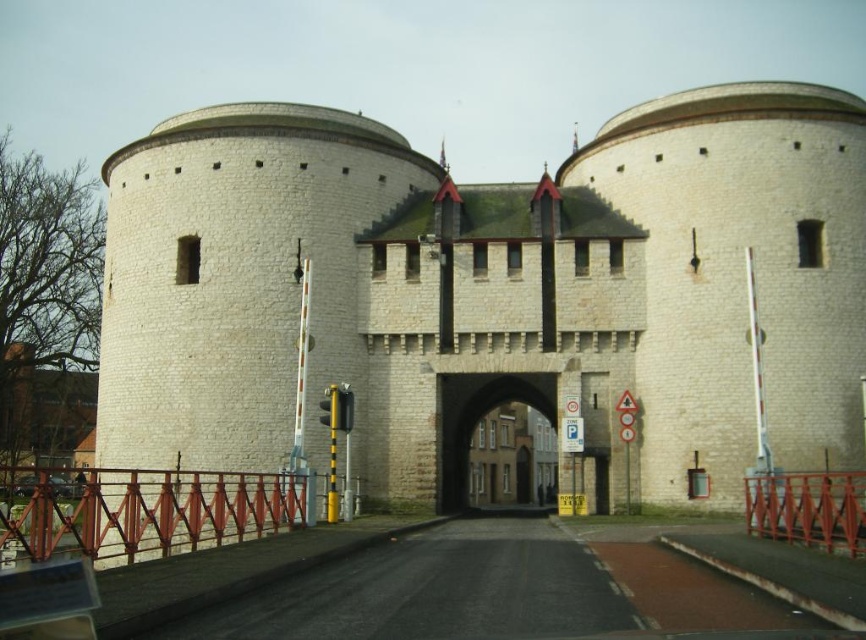
Is point (564, 461) positioned in front of point (454, 392)?

That is True.

Is point (285, 225) closer to viewer compared to point (493, 388)?

Yes, it is.

Identify the location of white stone castle at center. (492, 289).